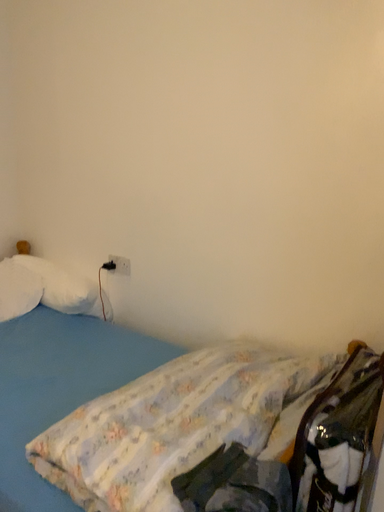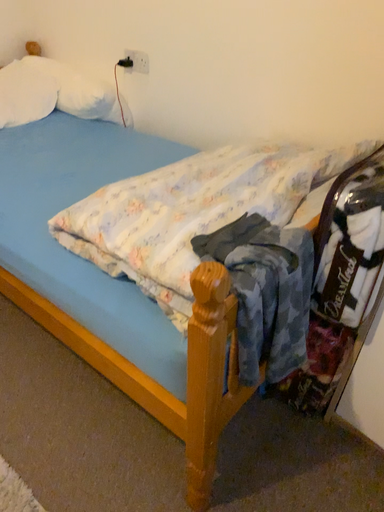
Question: Which way did the camera rotate in the video?

Choices:
 (A) rotated downward
 (B) rotated upward

Answer: (A)